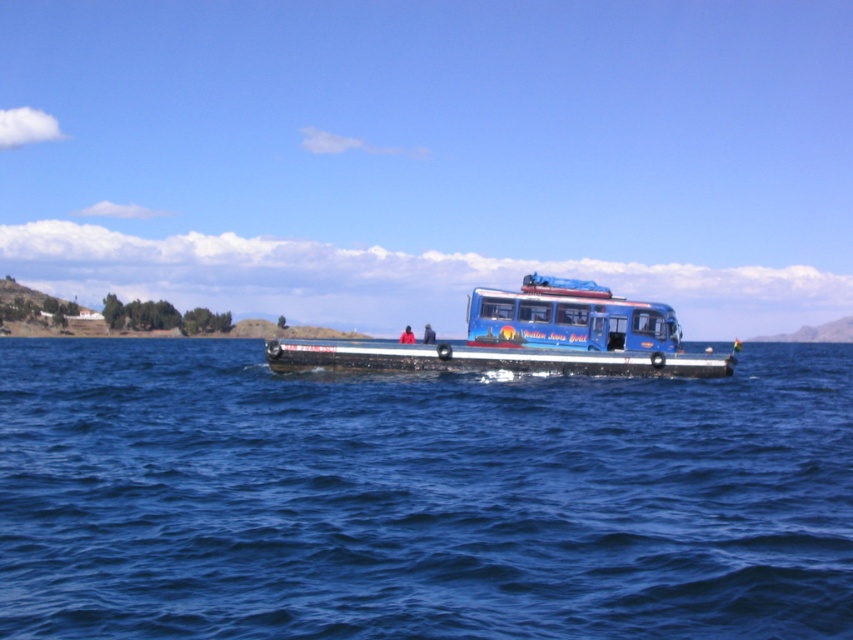
Can you confirm if blue water at center is taller than blue matte bus at center?

No, blue water at center is not taller than blue matte bus at center.

Can you confirm if blue water at center is bigger than blue matte bus at center?

Yes.

This screenshot has height=640, width=853. Identify the location of blue water at center. (418, 497).

Where is `blue water at center`? The width and height of the screenshot is (853, 640). blue water at center is located at coordinates (418, 497).